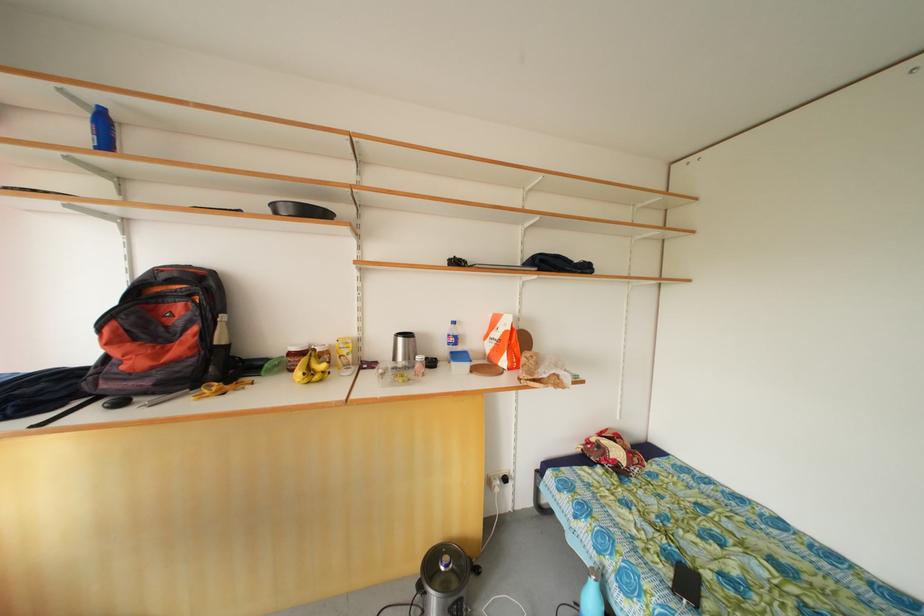
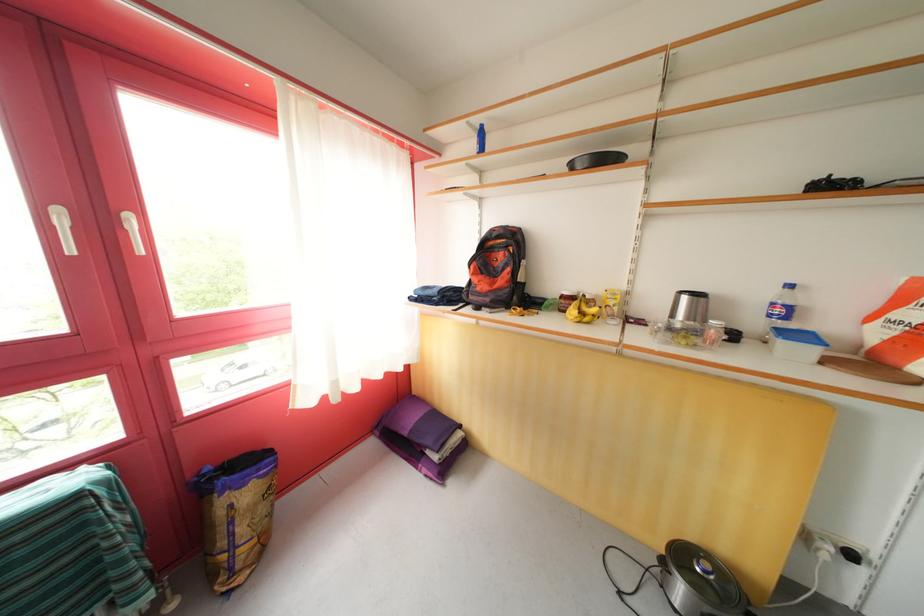
Question: How did the camera likely rotate?

Choices:
 (A) Left
 (B) Right
 (C) Up
 (D) Down

Answer: (A)